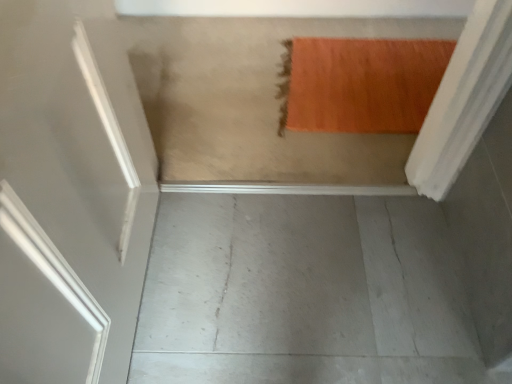
The image size is (512, 384). Describe the element at coordinates (303, 293) in the screenshot. I see `gray concrete floor at center` at that location.

What are the coordinates of `gray concrete floor at center` in the screenshot? It's located at (303, 293).

This screenshot has height=384, width=512. I want to click on gray concrete floor at center, so click(x=303, y=293).